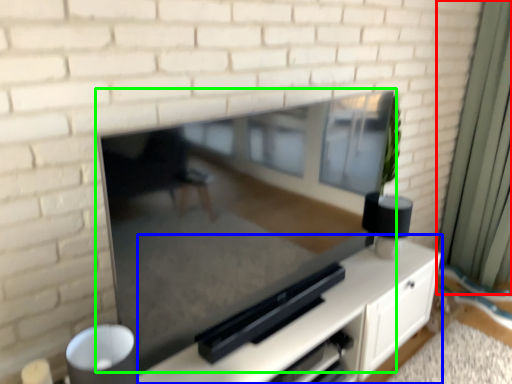
Question: Which is nearer to the curtain (highlighted by a red box)? entertainment center (highlighted by a blue box) or fireplace (highlighted by a green box).

Choices:
 (A) entertainment center
 (B) fireplace

Answer: (A)